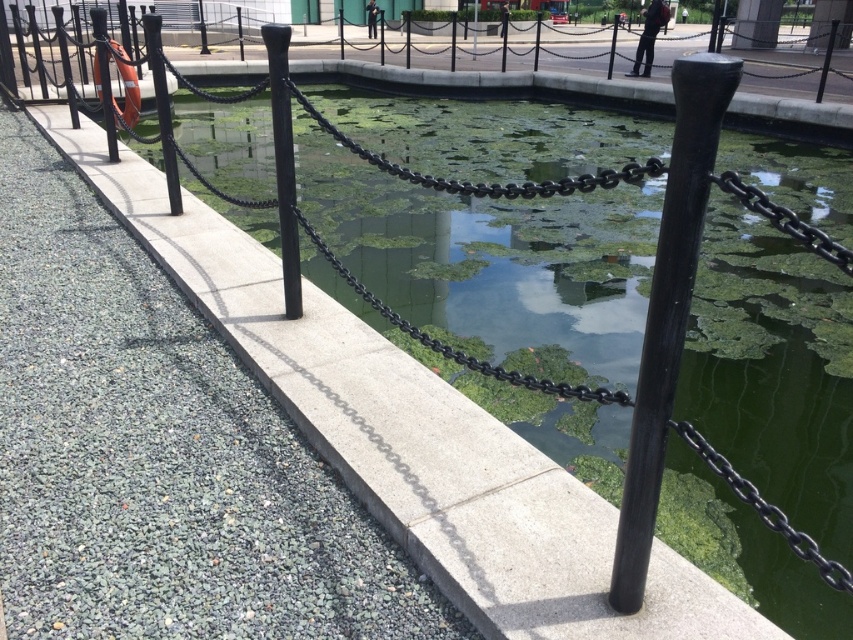
Question: Can you confirm if black matte pole at center is bigger than black metal pole at left?

Choices:
 (A) yes
 (B) no

Answer: (B)

Question: Considering the real-world distances, which object is farthest from the black metal fence at upper center?

Choices:
 (A) black polished metal pole at center
 (B) black matte pole at center
 (C) black metal pole at left

Answer: (A)

Question: Does black polished metal pole at center appear on the right side of black metal fence at upper center?

Choices:
 (A) no
 (B) yes

Answer: (B)

Question: Considering the relative positions of black metal fence at upper center and black metal pole at left in the image provided, where is black metal fence at upper center located with respect to black metal pole at left?

Choices:
 (A) above
 (B) below

Answer: (A)

Question: Which object appears closest to the camera in this image?

Choices:
 (A) black metal fence at upper center
 (B) black metal pole at left

Answer: (B)

Question: Which object is closer to the camera taking this photo?

Choices:
 (A) black metal fence at upper center
 (B) black matte pole at center

Answer: (B)